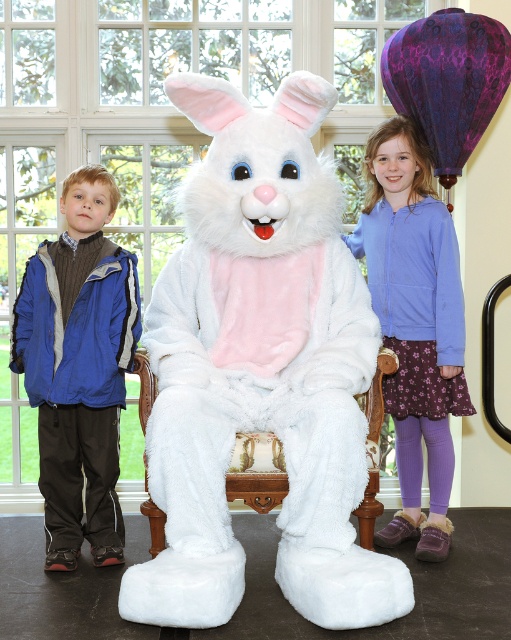
Between purple fleece jacket at upper right and white plush chair at center, which one is positioned lower?

white plush chair at center

Does purple fleece jacket at upper right appear under white plush chair at center?

Incorrect, purple fleece jacket at upper right is not positioned below white plush chair at center.

Is point (447, 472) more distant than point (157, 548)?

That is True.

Find the location of a particular element. The width and height of the screenshot is (511, 640). purple fleece jacket at upper right is located at coordinates (414, 324).

Does fluffy white bunny at center appear over purple fleece jacket at upper right?

Actually, fluffy white bunny at center is below purple fleece jacket at upper right.

Does point (341, 529) lie behind point (416, 244)?

No, it is in front of (416, 244).

Which is in front, point (336, 614) or point (383, 179)?

Point (336, 614)

Locate an element on the screen. The width and height of the screenshot is (511, 640). fluffy white bunny at center is located at coordinates (261, 369).

Can you confirm if blue fleece jacket at left is wider than purple fleece jacket at upper right?

Correct, the width of blue fleece jacket at left exceeds that of purple fleece jacket at upper right.

Is blue fleece jacket at left below purple fleece jacket at upper right?

Correct, blue fleece jacket at left is located below purple fleece jacket at upper right.

You are a GUI agent. You are given a task and a screenshot of the screen. Output one action in this format:
    pyautogui.click(x=<x>, y=<y>)
    Task: Click on the blue fleece jacket at left
    The height and width of the screenshot is (640, 511).
    Given the screenshot: What is the action you would take?
    pyautogui.click(x=79, y=368)